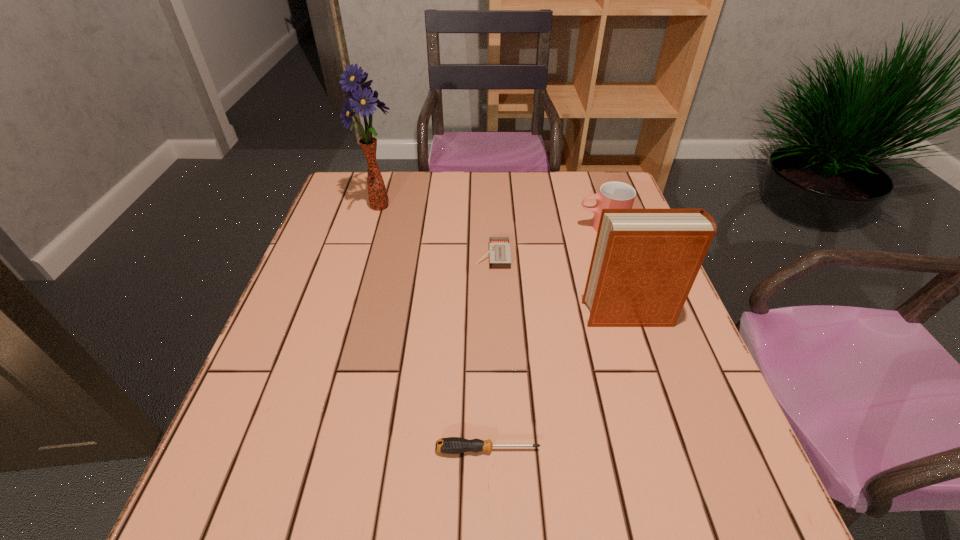
Identify the location of flower arrangement. This screenshot has width=960, height=540. (363, 99).

The image size is (960, 540). Identify the location of the tallest object. (363, 99).

Where is `hardback book`? The image size is (960, 540). hardback book is located at coordinates (644, 263).

Where is `the fourth farthest object`? This screenshot has width=960, height=540. the fourth farthest object is located at coordinates (644, 263).

Where is `cup`? The image size is (960, 540). cup is located at coordinates (612, 195).

I want to click on the third farthest object, so click(499, 247).

The image size is (960, 540). Find the location of `the nearest object`. the nearest object is located at coordinates (452, 445).

This screenshot has height=540, width=960. Find the location of `free space located on the right of the tallest object`. free space located on the right of the tallest object is located at coordinates (430, 207).

Locate an element on the screen. This screenshot has width=960, height=540. free spot located 0.330m on the open cover of the fourth shortest object is located at coordinates (438, 315).

The image size is (960, 540). I want to click on blank space located on the open cover of the fourth shortest object, so click(x=455, y=315).